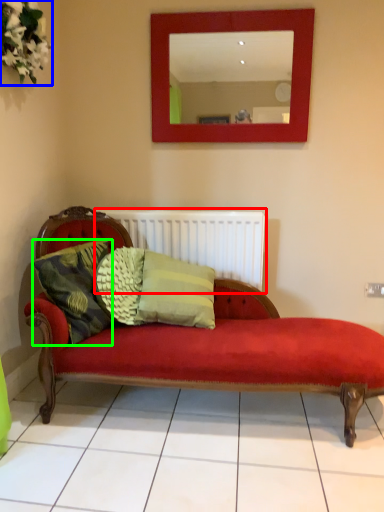
Question: Considering the real-world distances, which object is farthest from radiator (highlighted by a red box)? floral arrangement (highlighted by a blue box) or pillow (highlighted by a green box)?

Choices:
 (A) floral arrangement
 (B) pillow

Answer: (A)